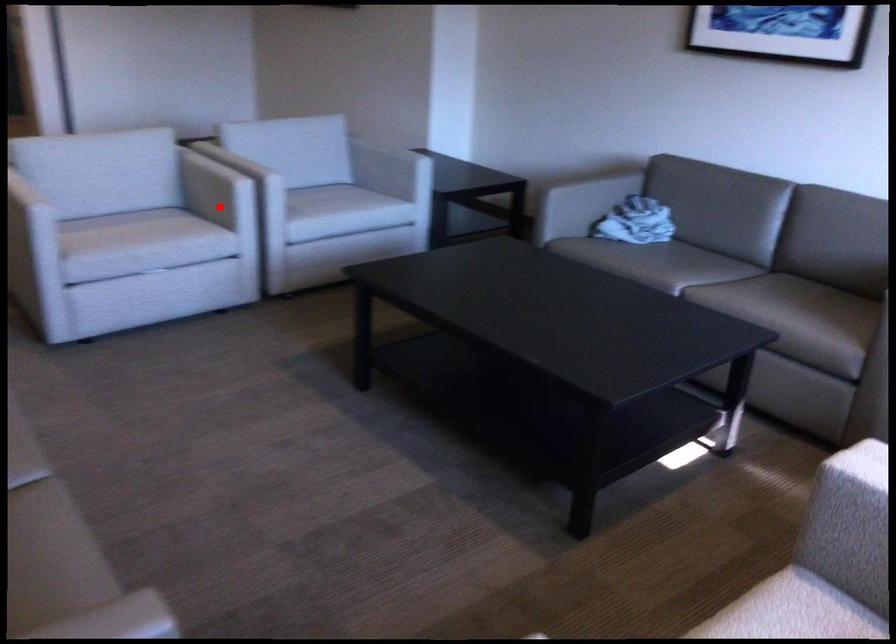
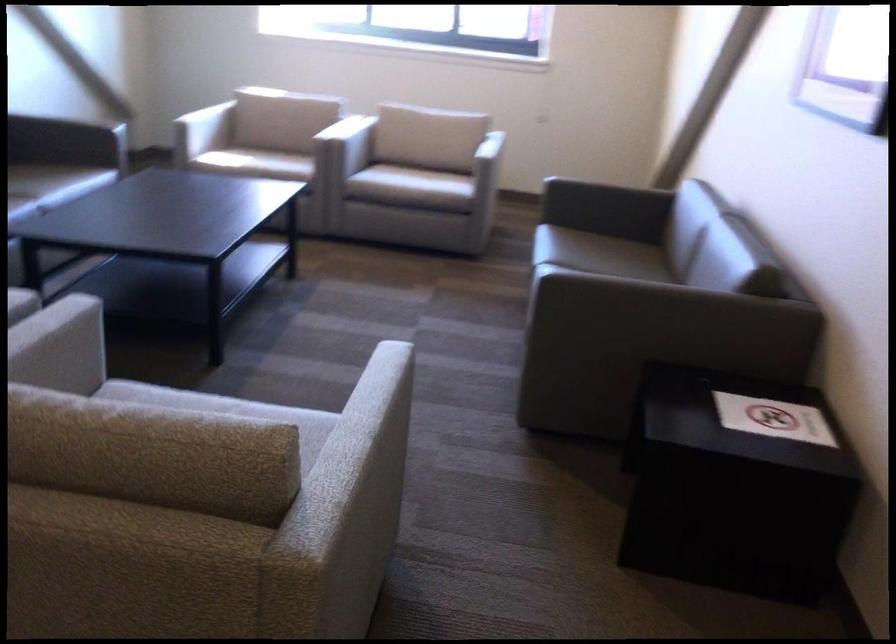
In the second image, find the point that corresponds to the highlighted location in the first image.

(58, 368)